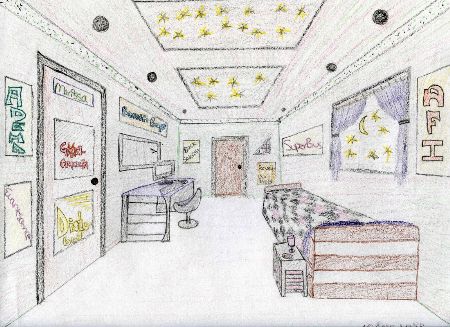
Where is `floor`? The image size is (450, 327). floor is located at coordinates (252, 294).